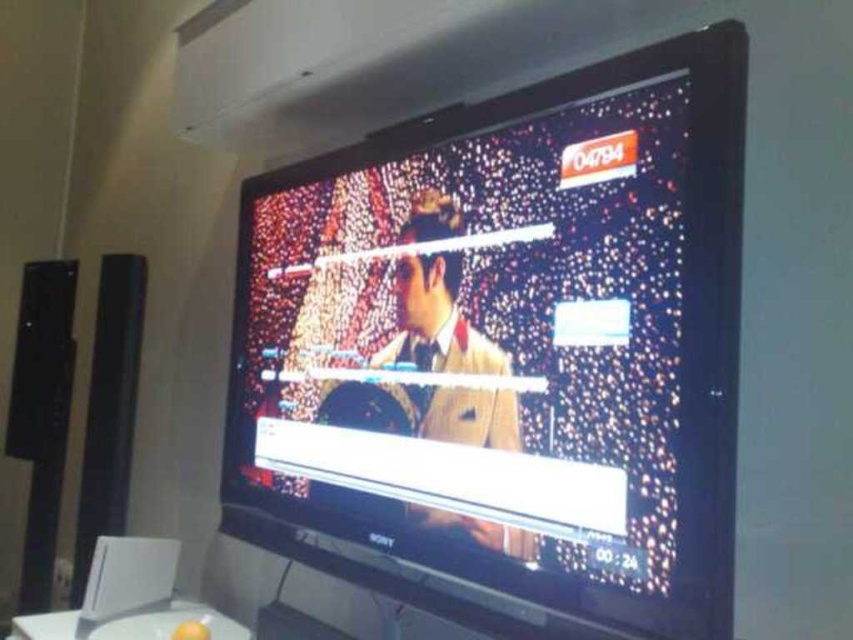
Question: Does black glossy tv at upper center appear on the left side of white glossy table at lower center?

Choices:
 (A) yes
 (B) no

Answer: (B)

Question: Does smooth beige suit at center have a larger size compared to black matte speaker at left?

Choices:
 (A) no
 (B) yes

Answer: (A)

Question: Estimate the real-world distances between objects in this image. Which object is closer to the black matte speaker at left?

Choices:
 (A) smooth beige suit at center
 (B) black glossy tv at upper center
 (C) white glossy table at lower center

Answer: (C)

Question: Which of these objects is positioned farthest from the black matte speaker at left?

Choices:
 (A) smooth beige suit at center
 (B) white glossy table at lower center
 (C) black glossy tv at upper center

Answer: (A)

Question: Considering the real-world distances, which object is farthest from the black glossy tv at upper center?

Choices:
 (A) black matte speaker at left
 (B) white glossy table at lower center

Answer: (A)

Question: Can you confirm if black glossy tv at upper center is bigger than black matte speaker at left?

Choices:
 (A) no
 (B) yes

Answer: (B)